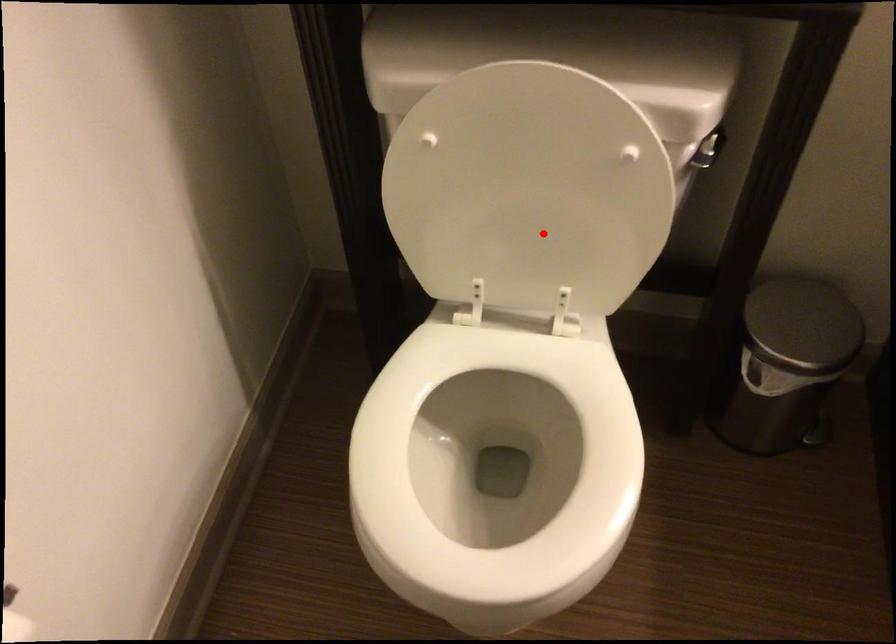
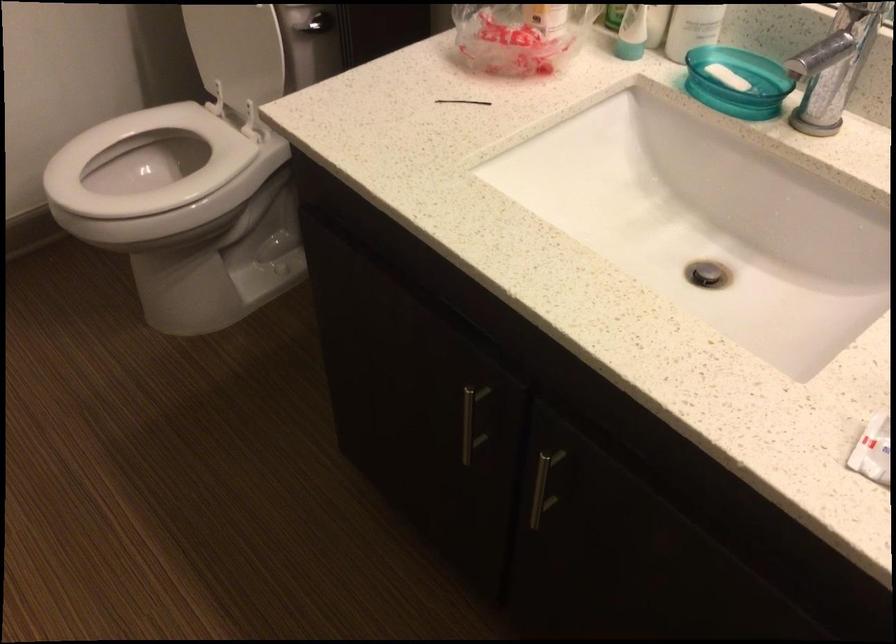
Where in the second image is the point corresponding to the highlighted location from the first image?

(237, 51)